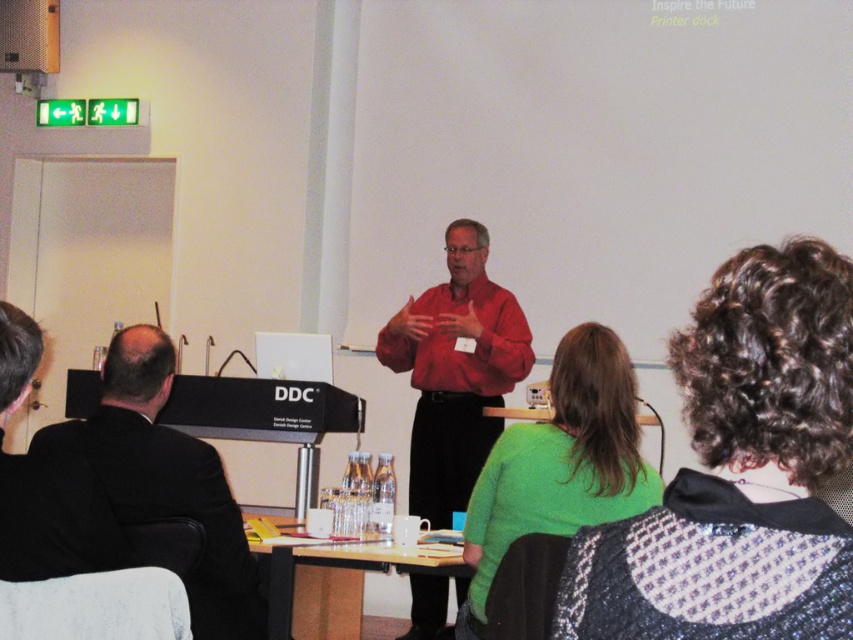
Question: Observing the image, what is the correct spatial positioning of matte red shirt at center in reference to wooden table at lower center?

Choices:
 (A) left
 (B) right

Answer: (B)

Question: Is black suit at left positioned at the back of wooden table at lower center?

Choices:
 (A) yes
 (B) no

Answer: (B)

Question: Is matte red shirt at center positioned behind black suit at left?

Choices:
 (A) yes
 (B) no

Answer: (A)

Question: Which of these objects is positioned farthest from the wooden table at lower center?

Choices:
 (A) black suit at left
 (B) matte red shirt at center

Answer: (B)

Question: Estimate the real-world distances between objects in this image. Which object is closer to the black suit at left?

Choices:
 (A) wooden table at lower center
 (B) matte red shirt at center

Answer: (A)

Question: Which object is farther from the camera taking this photo?

Choices:
 (A) black suit at left
 (B) matte red shirt at center
 (C) wooden table at lower center

Answer: (B)